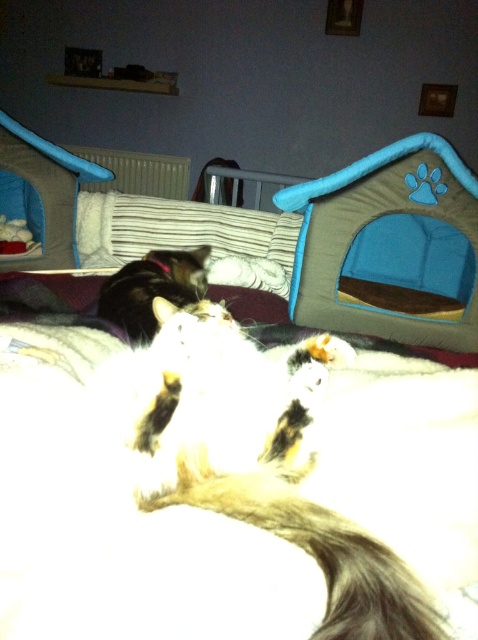
Question: In this image, where is blue fabric pet house at right located relative to brown fuzzy tail at center?

Choices:
 (A) below
 (B) above

Answer: (B)

Question: Which point appears closest to the camera in this image?

Choices:
 (A) (172, 298)
 (B) (355, 172)

Answer: (A)

Question: Which of the following is the closest to the observer?

Choices:
 (A) white fluffy cat at center
 (B) brown fuzzy tail at center
 (C) blue fabric pet house at right
 (D) fluffy black cat at center

Answer: (A)

Question: Among these points, which one is farthest from the camera?

Choices:
 (A) (274, 392)
 (B) (219, 477)
 (C) (132, 289)
 (D) (417, 166)

Answer: (D)

Question: Is brown fuzzy tail at center to the right of fluffy black cat at center from the viewer's perspective?

Choices:
 (A) yes
 (B) no

Answer: (A)

Question: Does white fluffy cat at center have a smaller size compared to brown fuzzy tail at center?

Choices:
 (A) no
 (B) yes

Answer: (A)